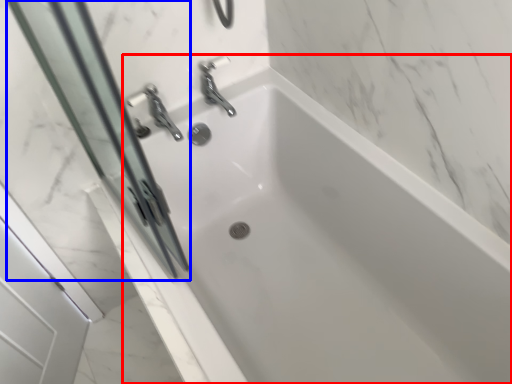
Question: Which point is closer to the camera, bathtub (highlighted by a red box) or screen door (highlighted by a blue box)?

Choices:
 (A) bathtub
 (B) screen door

Answer: (B)